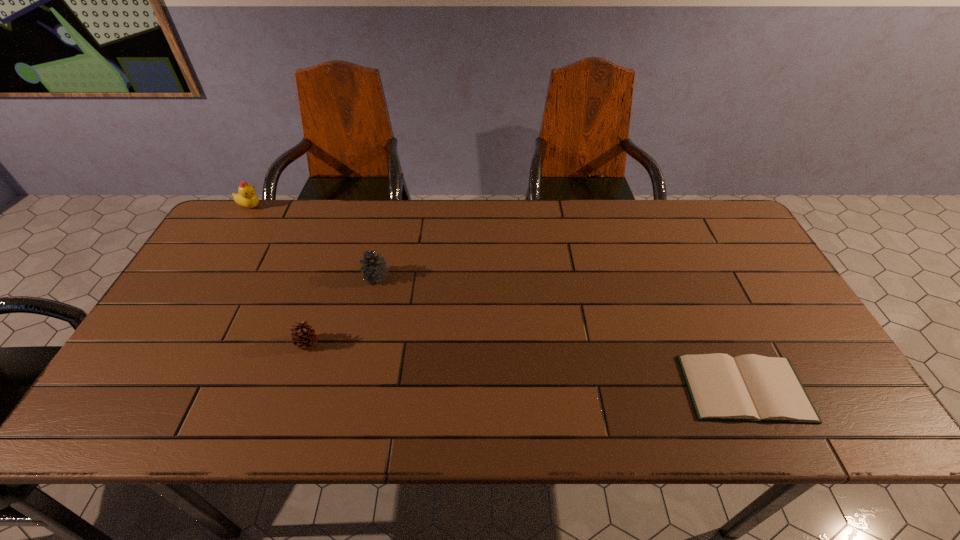
Locate an element on the screen. duckling is located at coordinates (246, 197).

The image size is (960, 540). I want to click on the farthest object, so click(x=246, y=197).

This screenshot has height=540, width=960. I want to click on the third nearest object, so click(x=375, y=270).

At what (x,y) coordinates should I click in order to perform the action: click on the right pinecone. Please return your answer as a coordinate pair (x, y). This screenshot has height=540, width=960. Looking at the image, I should click on (375, 270).

Identify the location of the left pinecone. The width and height of the screenshot is (960, 540). (303, 336).

I want to click on the second nearest object, so click(x=303, y=336).

Image resolution: width=960 pixels, height=540 pixels. In order to click on the nearest object in this screenshot , I will do `click(748, 388)`.

The height and width of the screenshot is (540, 960). What are the coordinates of `the rightmost object` in the screenshot? It's located at (748, 388).

I want to click on vacant area situated on the front-facing side of the leftmost object, so click(x=356, y=206).

This screenshot has width=960, height=540. I want to click on vacant space located on the front of the right pinecone, so click(356, 363).